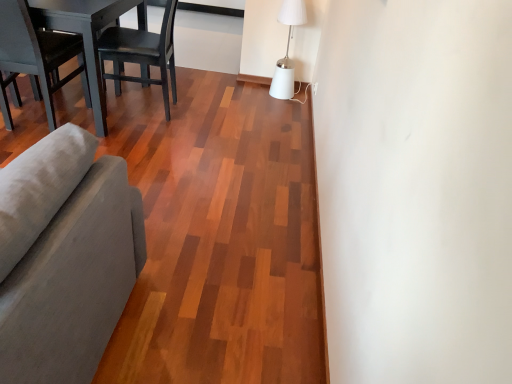
Question: Can matte gray chair at left, which ranks as the 2th chair in right-to-left order, be found inside white matte table lamp at upper right?

Choices:
 (A) yes
 (B) no

Answer: (B)

Question: Is white matte table lamp at upper right outside of matte gray chair at left, which ranks as the 2th chair in right-to-left order?

Choices:
 (A) no
 (B) yes

Answer: (B)

Question: Is the position of white matte table lamp at upper right more distant than that of matte gray chair at left, the first chair viewed from the left?

Choices:
 (A) no
 (B) yes

Answer: (B)

Question: Does white matte table lamp at upper right have a greater width compared to matte gray chair at left, the first chair viewed from the left?

Choices:
 (A) yes
 (B) no

Answer: (B)

Question: Considering the relative sizes of white matte table lamp at upper right and matte gray chair at left, which ranks as the 2th chair in right-to-left order, in the image provided, is white matte table lamp at upper right smaller than matte gray chair at left, which ranks as the 2th chair in right-to-left order,?

Choices:
 (A) no
 (B) yes

Answer: (B)

Question: From a real-world perspective, is white matte table lamp at upper right located higher than matte gray chair at left, which ranks as the 2th chair in right-to-left order?

Choices:
 (A) no
 (B) yes

Answer: (A)

Question: Considering the relative sizes of black matte wood chair at upper left, the second chair in the left-to-right sequence, and matte gray chair at left, the first chair viewed from the left, in the image provided, is black matte wood chair at upper left, the second chair in the left-to-right sequence, bigger than matte gray chair at left, the first chair viewed from the left,?

Choices:
 (A) yes
 (B) no

Answer: (A)

Question: Is black matte wood chair at upper left, positioned as the first chair in right-to-left order, thinner than matte gray chair at left, the first chair viewed from the left?

Choices:
 (A) no
 (B) yes

Answer: (A)

Question: Does black matte wood chair at upper left, the second chair in the left-to-right sequence, have a greater width compared to matte gray chair at left, which ranks as the 2th chair in right-to-left order?

Choices:
 (A) yes
 (B) no

Answer: (A)

Question: Is matte gray chair at left, the first chair viewed from the left, at the back of black matte wood chair at upper left, positioned as the first chair in right-to-left order?

Choices:
 (A) no
 (B) yes

Answer: (A)

Question: Is black matte wood chair at upper left, positioned as the first chair in right-to-left order, smaller than matte gray chair at left, which ranks as the 2th chair in right-to-left order?

Choices:
 (A) yes
 (B) no

Answer: (B)

Question: From a real-world perspective, is black matte wood chair at upper left, positioned as the first chair in right-to-left order, beneath matte gray chair at left, the first chair viewed from the left?

Choices:
 (A) yes
 (B) no

Answer: (A)

Question: Can you confirm if matte gray chair at left, the first chair viewed from the left, is smaller than white matte table lamp at upper right?

Choices:
 (A) yes
 (B) no

Answer: (B)